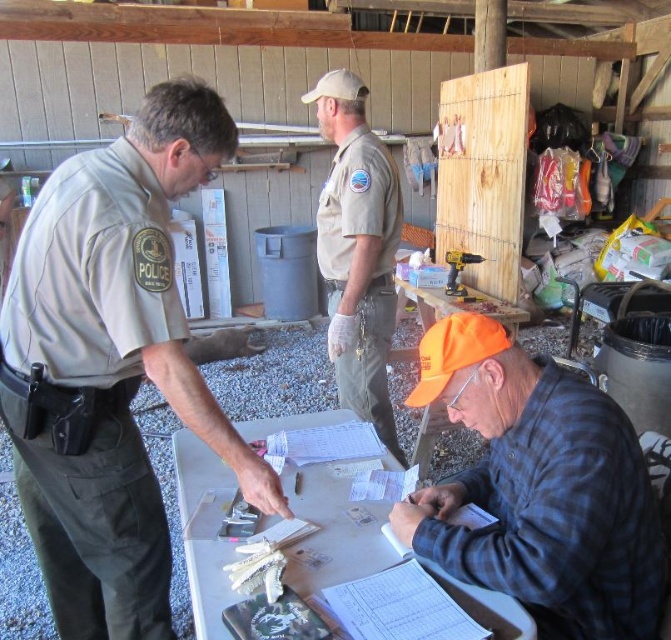
Question: Which object is positioned closest to the white paper at center?

Choices:
 (A) tan uniform at center
 (B) tan uniform at left
 (C) orange fabric cap at lower right
 (D) black plastic drill at center

Answer: (C)

Question: Which is nearer to the orange fabric cap at lower right?

Choices:
 (A) black plastic drill at center
 (B) white paper at center
 (C) tan uniform at left

Answer: (B)

Question: Is tan uniform at left in front of orange fabric cap at lower right?

Choices:
 (A) yes
 (B) no

Answer: (B)

Question: Is the position of orange fabric cap at lower right more distant than that of white paper at center?

Choices:
 (A) yes
 (B) no

Answer: (A)

Question: Does orange fabric cap at lower right have a lesser width compared to white paper at center?

Choices:
 (A) yes
 (B) no

Answer: (A)

Question: Which point is farther to the camera?

Choices:
 (A) orange fabric cap at lower right
 (B) white paper at center

Answer: (A)